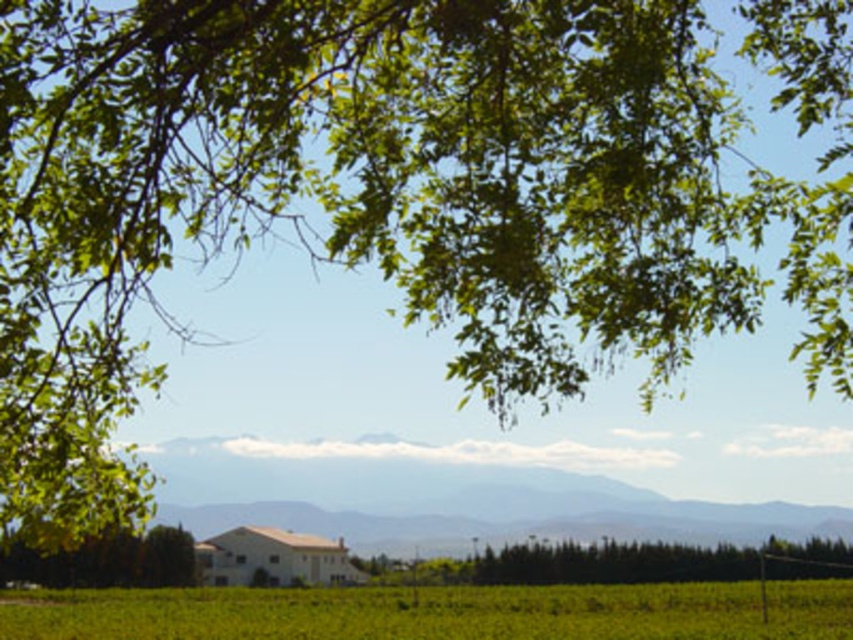
What are the coordinates of the green leafy tree at center?

The green leafy tree at center is located at coordinates point (645, 563).

You are standing at the edge of the field looking towards the house. Which object, the green grass at lower center or the green leafy tree at center, is closer to you?

The green grass at lower center is closer to you because it is positioned below the green leafy tree at center, indicating it is in the foreground.